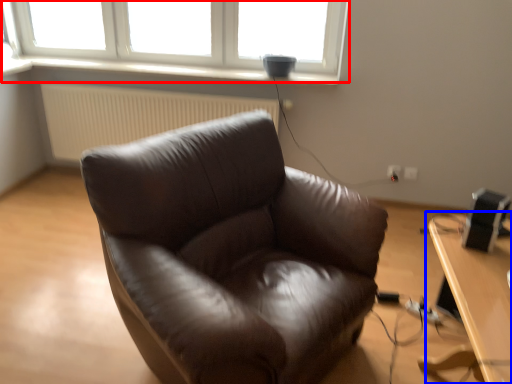
Question: Which object is closer to the camera taking this photo, window (highlighted by a red box) or table (highlighted by a blue box)?

Choices:
 (A) window
 (B) table

Answer: (B)